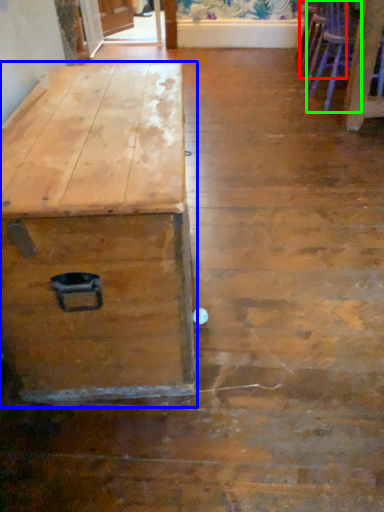
Question: Which object is the closest to the armchair (highlighted by a red box)? Choose among these: table (highlighted by a blue box) or armchair (highlighted by a green box).

Choices:
 (A) table
 (B) armchair

Answer: (B)